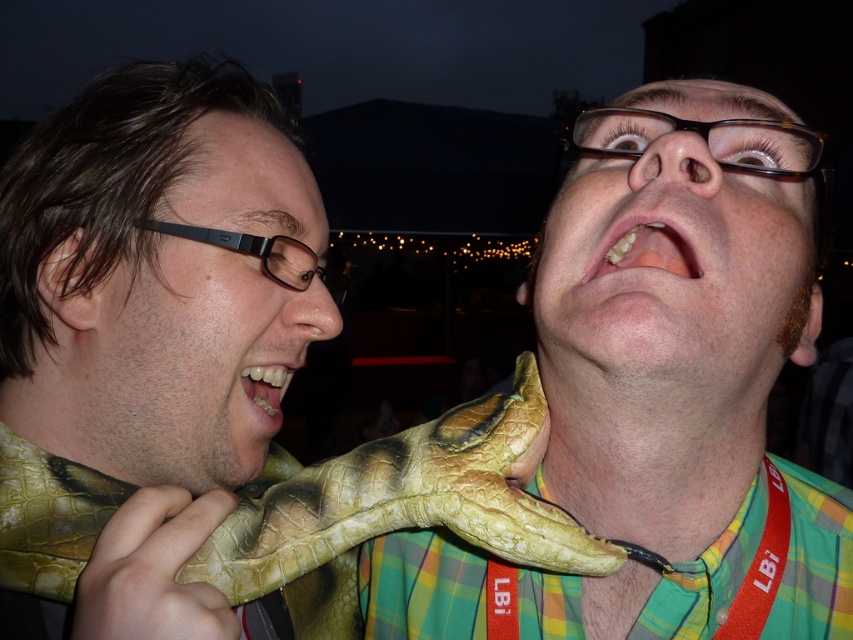
Is matte black glasses at upper center in front of yellow matte teeth at center?

Yes, it is in front of yellow matte teeth at center.

Can you confirm if matte black glasses at upper center is positioned to the left of yellow matte teeth at center?

No, matte black glasses at upper center is not to the left of yellow matte teeth at center.

Image resolution: width=853 pixels, height=640 pixels. Identify the location of matte black glasses at upper center. (683, 240).

Find the location of `matte black glasses at upper center`. matte black glasses at upper center is located at coordinates (683, 240).

Looking at this image, does leather-like yellow-green dinosaur hand at upper right have a larger size compared to yellow matte teeth at center?

Indeed, leather-like yellow-green dinosaur hand at upper right has a larger size compared to yellow matte teeth at center.

Between leather-like yellow-green dinosaur hand at upper right and yellow matte teeth at center, which one is positioned higher?

yellow matte teeth at center

Describe the element at coordinates (645, 376) in the screenshot. I see `leather-like yellow-green dinosaur hand at upper right` at that location.

Where is `leather-like yellow-green dinosaur hand at upper right`? The image size is (853, 640). leather-like yellow-green dinosaur hand at upper right is located at coordinates (645, 376).

Does matte black glasses at left have a lesser height compared to leathery yellow-green python at center?

Incorrect, matte black glasses at left's height does not fall short of leathery yellow-green python at center's.

Who is higher up, matte black glasses at left or leathery yellow-green python at center?

matte black glasses at left

Consider the image. Who is more forward, (244, 138) or (483, 486)?

Point (483, 486)

At what (x,y) coordinates should I click in order to perform the action: click on matte black glasses at left. Please return your answer as a coordinate pair (x, y). Looking at the image, I should click on (177, 365).